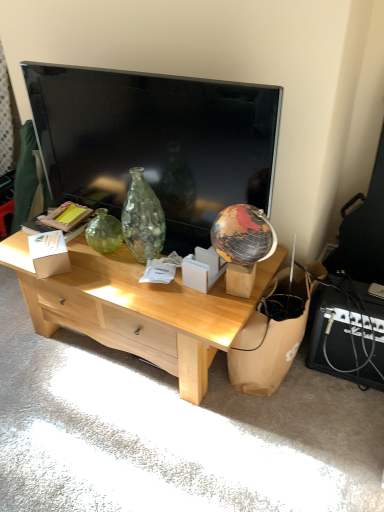
You are a GUI agent. You are given a task and a screenshot of the screen. Output one action in this format:
    pyautogui.click(x=<x>, y=<y>)
    Task: Click on the vacant area on top of white cardboard box at center, which is the first cardboard box from left to right (from a real-world perspective)
    
    Given the screenshot: What is the action you would take?
    pyautogui.click(x=46, y=240)